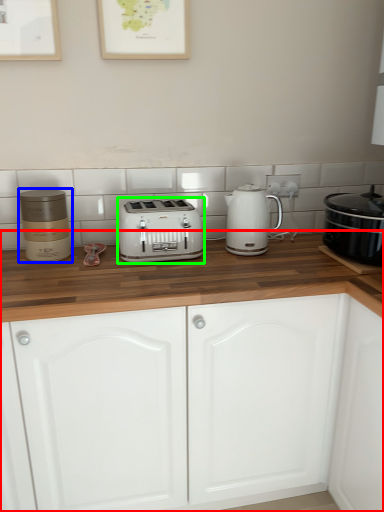
Question: Based on their relative distances, which object is farther from cabinetry (highlighted by a red box)? Choose from appliance (highlighted by a blue box) and toaster (highlighted by a green box).

Choices:
 (A) appliance
 (B) toaster

Answer: (A)